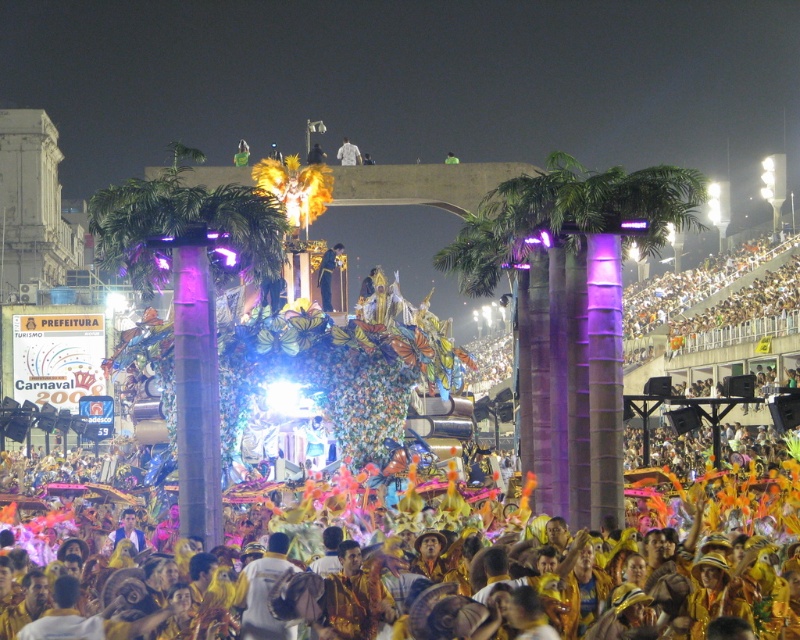
From the picture: Which of these two, purple metallic palm tree at center or white fabric at center, stands shorter?

white fabric at center is shorter.

Can you confirm if purple metallic palm tree at center is wider than white fabric at center?

Indeed, purple metallic palm tree at center has a greater width compared to white fabric at center.

Does point (141, 291) come closer to viewer compared to point (356, 161)?

Yes, point (141, 291) is in front of point (356, 161).

Where is `purple metallic palm tree at center`? This screenshot has width=800, height=640. purple metallic palm tree at center is located at coordinates (189, 300).

Who is more forward, (617, 204) or (222, 241)?

Point (617, 204) is more forward.

Can you confirm if green leafy palm at center is smaller than purple metallic palm tree at center?

Yes.

Which is behind, point (548, 384) or point (200, 220)?

The point (548, 384) is more distant.

This screenshot has width=800, height=640. I want to click on green leafy palm at center, so click(570, 310).

Who is shorter, green leafy palm at center or white fabric at center?

white fabric at center

Does green leafy palm at center come in front of white fabric at center?

That is True.

In order to click on green leafy palm at center in this screenshot , I will do `click(570, 310)`.